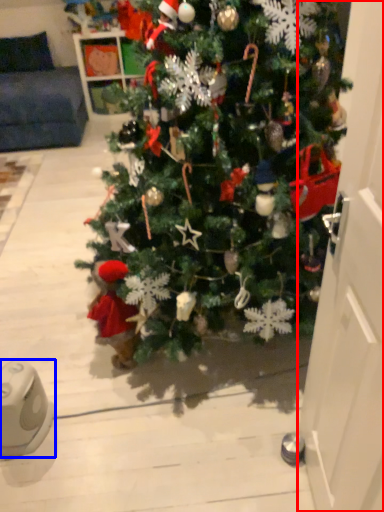
Question: Which of the following is the farthest to the observer, door (highlighted by a red box) or ipod (highlighted by a blue box)?

Choices:
 (A) door
 (B) ipod

Answer: (B)